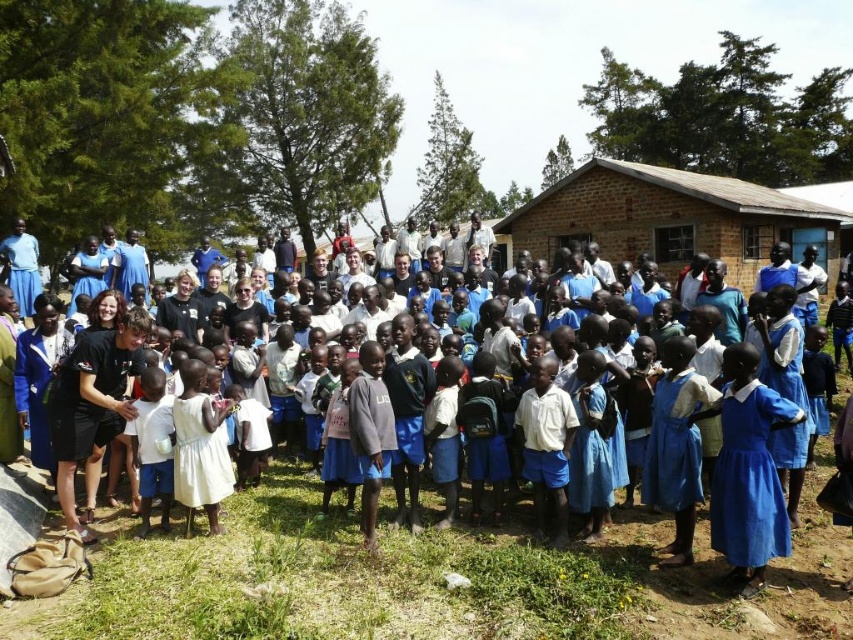
Is point (693, 225) closer to camera compared to point (750, 381)?

No.

Locate an element on the screen. Image resolution: width=853 pixels, height=640 pixels. brown brick hut at center is located at coordinates (670, 218).

Between point (631, 512) and point (627, 188), which one is positioned behind?

The point (627, 188) is more distant.

Is point (305, 608) in front of point (688, 218)?

That is True.

Image resolution: width=853 pixels, height=640 pixels. I want to click on black fabric dress at center, so [430, 564].

Based on the photo, can you confirm if black fabric dress at center is bigger than blue matte dress at lower right?

Yes, black fabric dress at center is bigger than blue matte dress at lower right.

Is black fabric dress at center shorter than blue matte dress at lower right?

Yes, black fabric dress at center is shorter than blue matte dress at lower right.

Between point (811, 582) and point (711, 516), which one is positioned behind?

The point (711, 516) is behind.

Where is `black fabric dress at center`? The image size is (853, 640). black fabric dress at center is located at coordinates (430, 564).